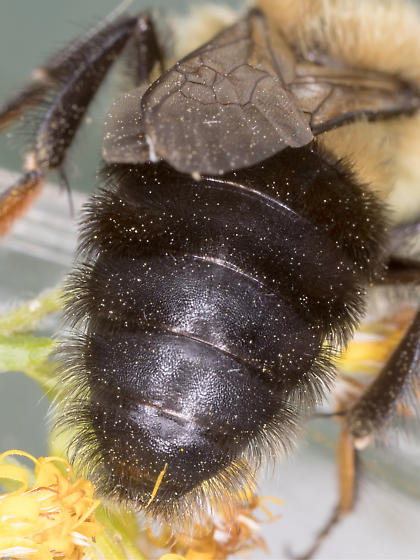
Where is `rightmost leg`? rightmost leg is located at coordinates (385, 380).